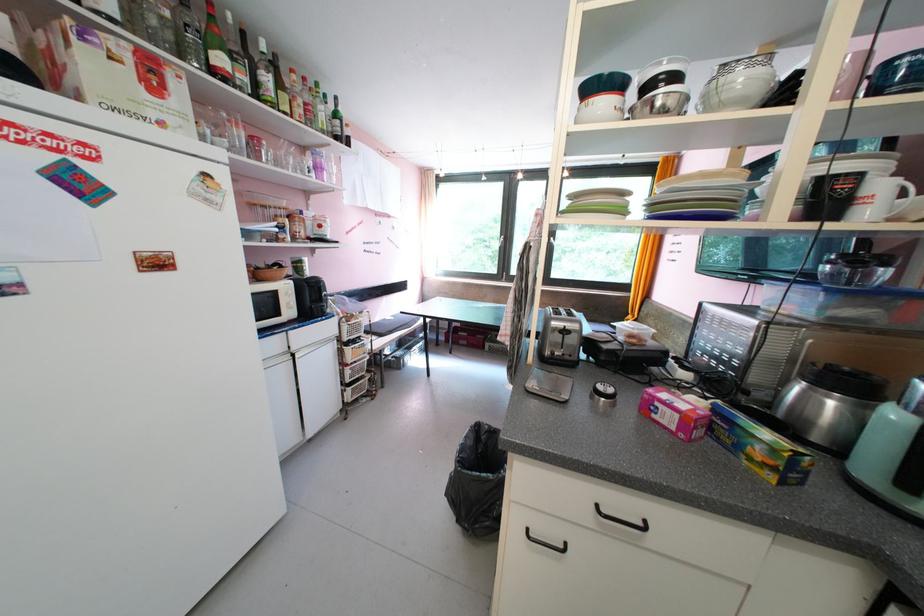
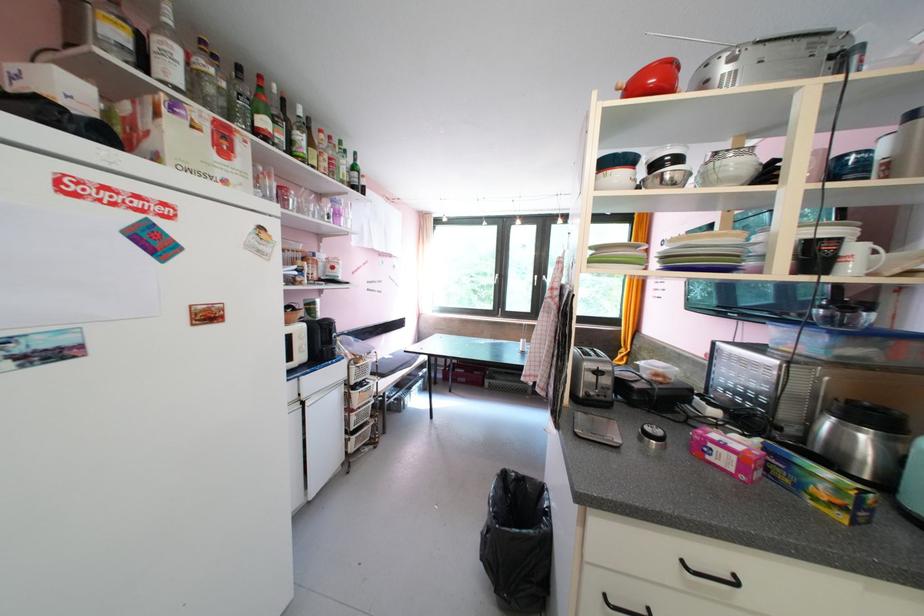
Find the pixel in the second image that matches [779,479] in the first image.

(849, 519)